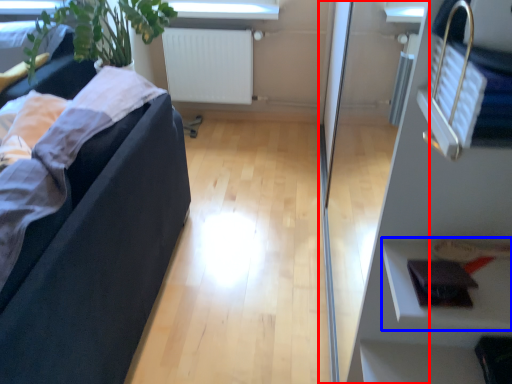
Question: Which of the following is the closest to the observer, glass door (highlighted by a red box) or shelf (highlighted by a blue box)?

Choices:
 (A) glass door
 (B) shelf

Answer: (A)